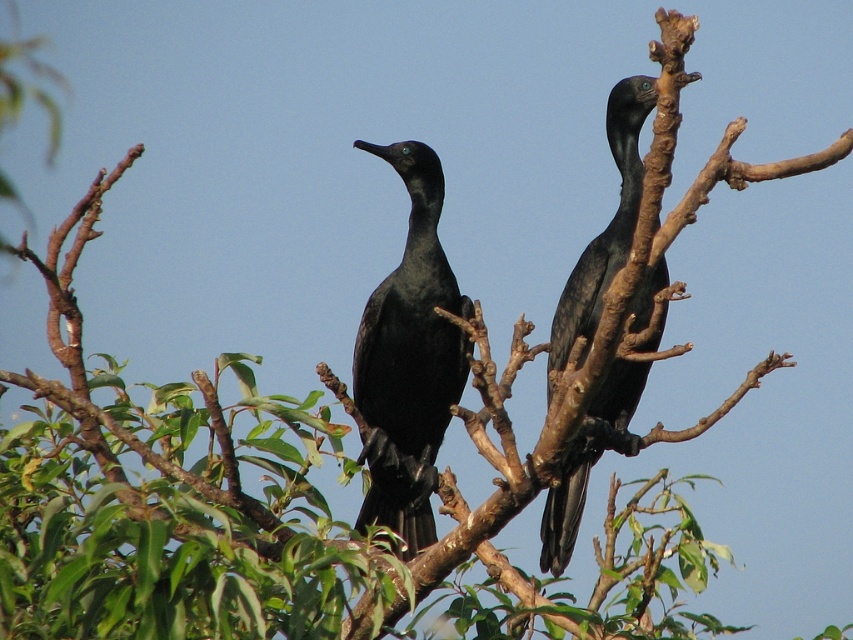
Question: Which point is farther from the camera taking this photo?

Choices:
 (A) (407, 243)
 (B) (605, 109)

Answer: (B)

Question: Does shiny black bird at center appear over shiny black bird at upper right?

Choices:
 (A) yes
 (B) no

Answer: (B)

Question: Is shiny black bird at center in front of shiny black bird at upper right?

Choices:
 (A) no
 (B) yes

Answer: (A)

Question: Is shiny black bird at center further to the viewer compared to shiny black bird at upper right?

Choices:
 (A) no
 (B) yes

Answer: (B)